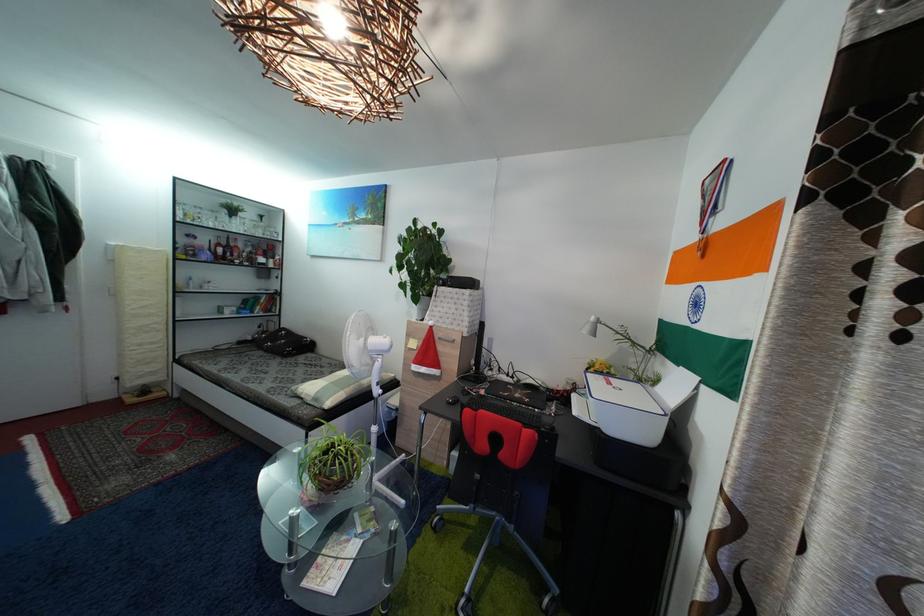
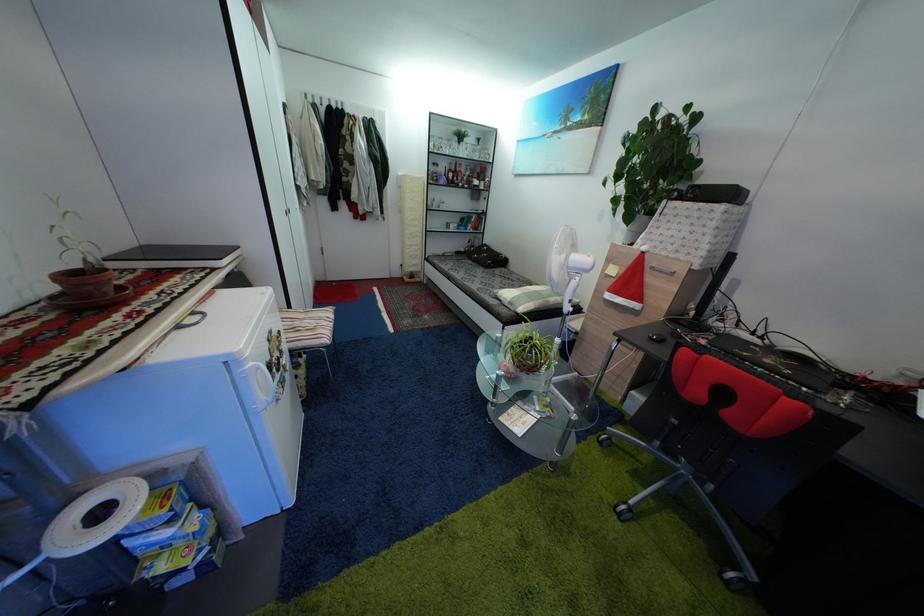
Find the pixel in the second image that matches (327,567) in the first image.

(517, 418)